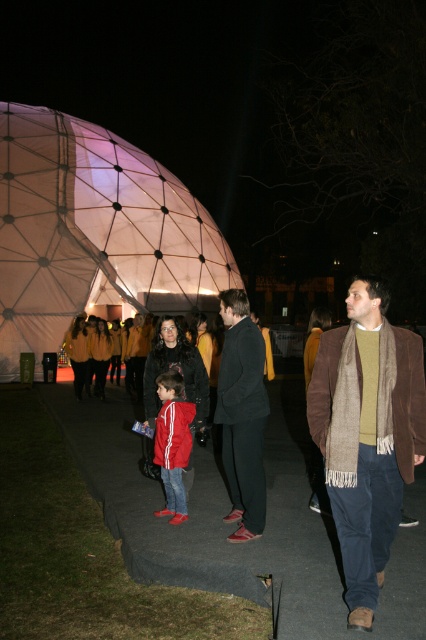
Based on the photo, you are a fashion designer observing the outdoor nighttime scene. You notice the brown woolen scarf at center and the red matte jacket at center. Which item has a greater height in this scene?

The brown woolen scarf at center is taller than the red matte jacket at center.

You are organizing a costume party and need to decide which item to place in a small display case. The case can only hold items up to the size of the red matte jacket at center. Can the brown woolen scarf at center fit in the case?

The brown woolen scarf at center is bigger than the red matte jacket at center, so it cannot fit in the display case designed for items up to the size of the red matte jacket at center.